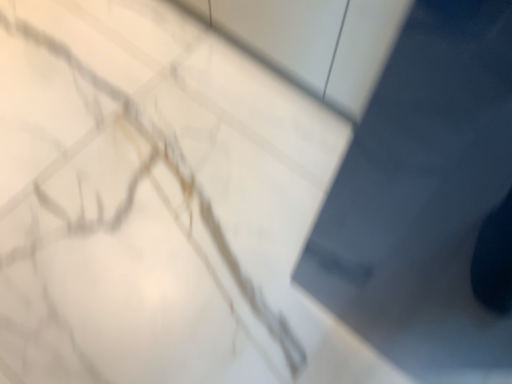
Locate an element on the screen. Image resolution: width=512 pixels, height=384 pixels. vacant region above white marble crack at center (from a real-world perspective) is located at coordinates (156, 169).